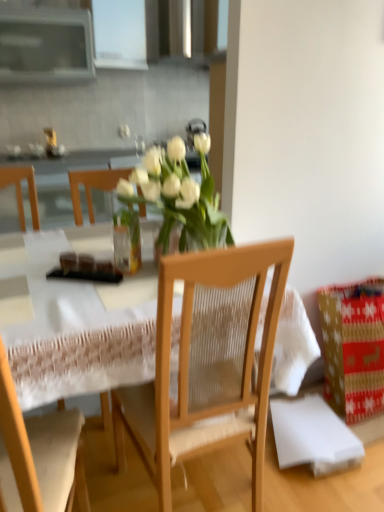
Question: Does red paper gift at lower right have a greater height compared to wooden table at center?

Choices:
 (A) no
 (B) yes

Answer: (A)

Question: Is red paper gift at lower right in contact with wooden table at center?

Choices:
 (A) yes
 (B) no

Answer: (B)

Question: Considering the relative positions of red paper gift at lower right and wooden table at center in the image provided, is red paper gift at lower right to the left of wooden table at center from the viewer's perspective?

Choices:
 (A) yes
 (B) no

Answer: (B)

Question: Is the position of red paper gift at lower right less distant than that of wooden table at center?

Choices:
 (A) no
 (B) yes

Answer: (A)

Question: From a real-world perspective, is red paper gift at lower right physically above wooden table at center?

Choices:
 (A) yes
 (B) no

Answer: (B)

Question: Choose the correct answer: Is transparent glass vase at center inside wooden chair at center, which appears as the 1th chair when viewed from the left, or outside it?

Choices:
 (A) inside
 (B) outside

Answer: (B)

Question: Looking at the image, does transparent glass vase at center seem bigger or smaller compared to wooden chair at center, which appears as the 1th chair when viewed from the left?

Choices:
 (A) big
 (B) small

Answer: (B)

Question: Looking at their shapes, would you say transparent glass vase at center is wider or thinner than wooden chair at center, positioned as the 2th chair in right-to-left order?

Choices:
 (A) wide
 (B) thin

Answer: (B)

Question: Would you say transparent glass vase at center is to the left or to the right of wooden chair at center, which appears as the 1th chair when viewed from the left, in the picture?

Choices:
 (A) left
 (B) right

Answer: (B)

Question: Looking at their shapes, would you say red paper gift at lower right is wider or thinner than wooden chair at center, positioned as the 2th chair in right-to-left order?

Choices:
 (A) wide
 (B) thin

Answer: (B)

Question: Would you say red paper gift at lower right is to the left or to the right of wooden chair at center, which appears as the 1th chair when viewed from the left, in the picture?

Choices:
 (A) right
 (B) left

Answer: (A)

Question: Considering their positions, is red paper gift at lower right located in front of or behind wooden chair at center, which appears as the 1th chair when viewed from the left?

Choices:
 (A) behind
 (B) front

Answer: (A)

Question: Is red paper gift at lower right inside or outside of wooden chair at center, positioned as the 2th chair in right-to-left order?

Choices:
 (A) inside
 (B) outside

Answer: (B)

Question: Considering their positions, is matte brown bread at table located in front of or behind wooden table at center?

Choices:
 (A) front
 (B) behind

Answer: (B)

Question: From a real-world perspective, is matte brown bread at table above or below wooden table at center?

Choices:
 (A) above
 (B) below

Answer: (A)